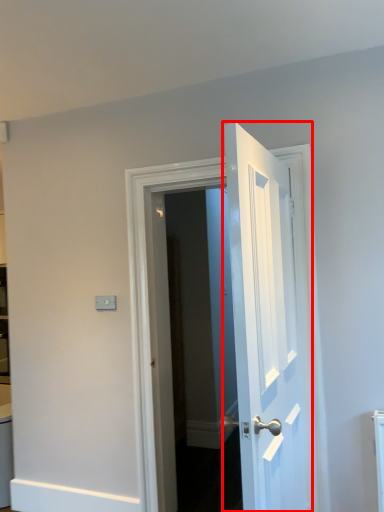
Question: From the image's perspective, where is door (annotated by the red box) located relative to door?

Choices:
 (A) below
 (B) above

Answer: (B)